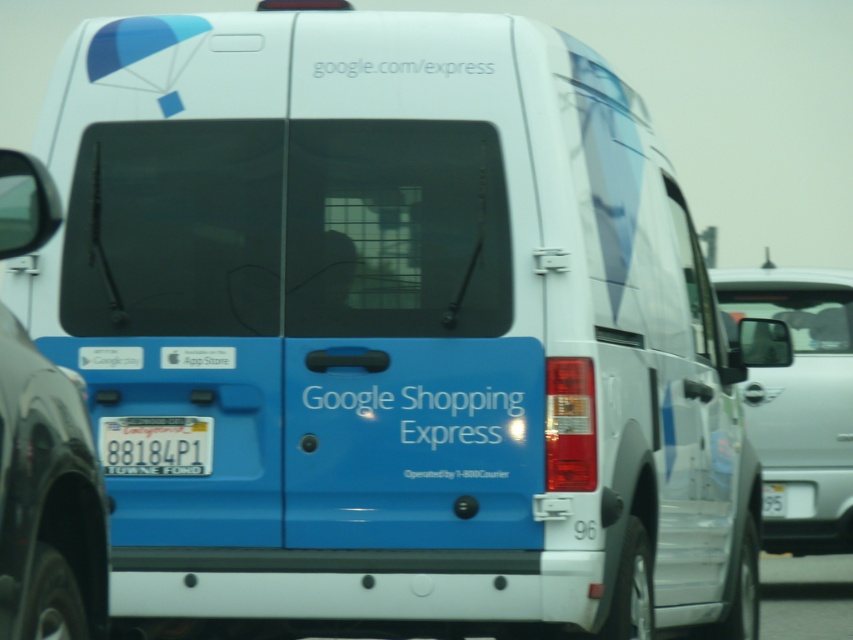
Is point (799, 451) closer to camera compared to point (207, 464)?

No, (799, 451) is further to viewer.

Between point (827, 532) and point (194, 468), which one is positioned behind?

Point (827, 532)

The width and height of the screenshot is (853, 640). What are the coordinates of `silver metallic van at right` in the screenshot? It's located at (799, 404).